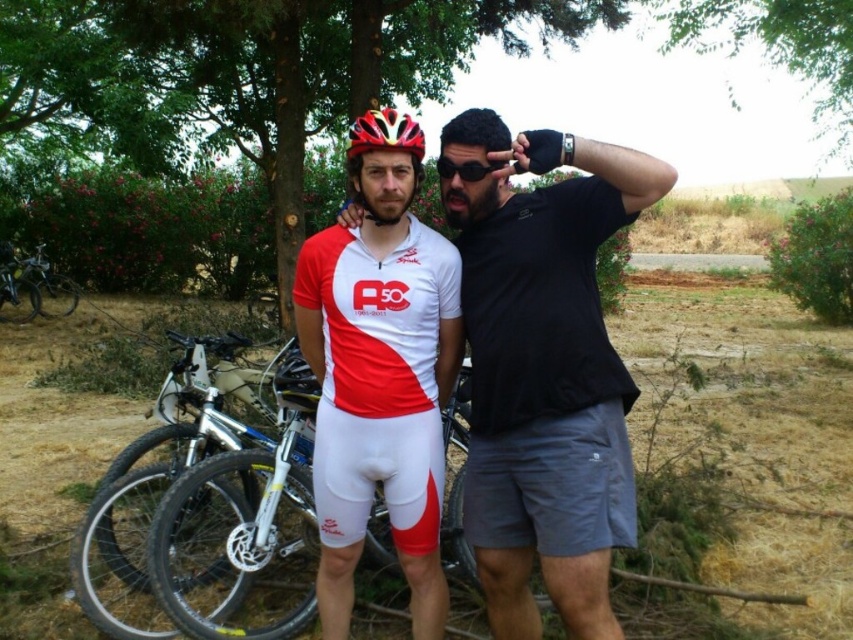
Question: Does matte red and white cycling suit at center have a smaller size compared to red matte helmet at center?

Choices:
 (A) yes
 (B) no

Answer: (B)

Question: Does matte red cycling suit at center appear on the left side of silver metallic mountain bike at center?

Choices:
 (A) yes
 (B) no

Answer: (B)

Question: Among these objects, which one is farthest from the camera?

Choices:
 (A) matte red cycling suit at center
 (B) shiny red helmet at center

Answer: (B)

Question: Estimate the real-world distances between objects in this image. Which object is closer to the shiny red helmet at center?

Choices:
 (A) silver metallic bicycle at left
 (B) matte red cycling suit at center

Answer: (B)

Question: Based on their relative distances, which object is farther from the silver metallic bicycle at left?

Choices:
 (A) shiny red helmet at center
 (B) black matte sunglasses at center

Answer: (B)

Question: Can you confirm if matte red cycling suit at center is positioned to the right of red matte helmet at center?

Choices:
 (A) no
 (B) yes

Answer: (B)